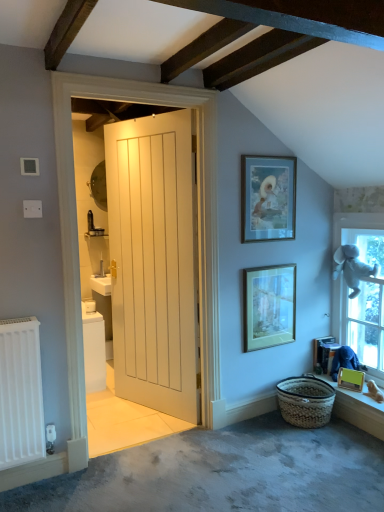
Locate an element on the screen. The height and width of the screenshot is (512, 384). free space above white plush toy at right (from a real-world perspective) is located at coordinates (361, 215).